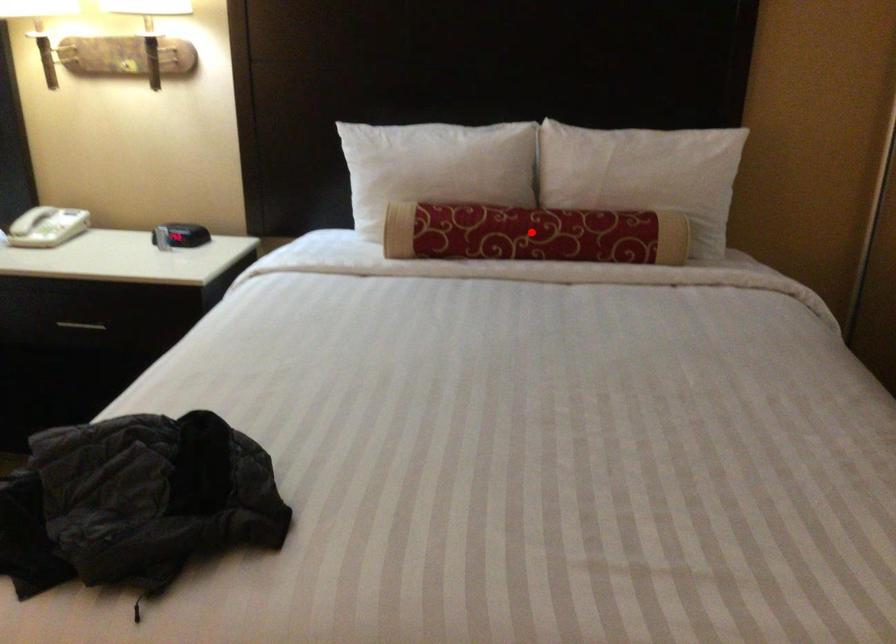
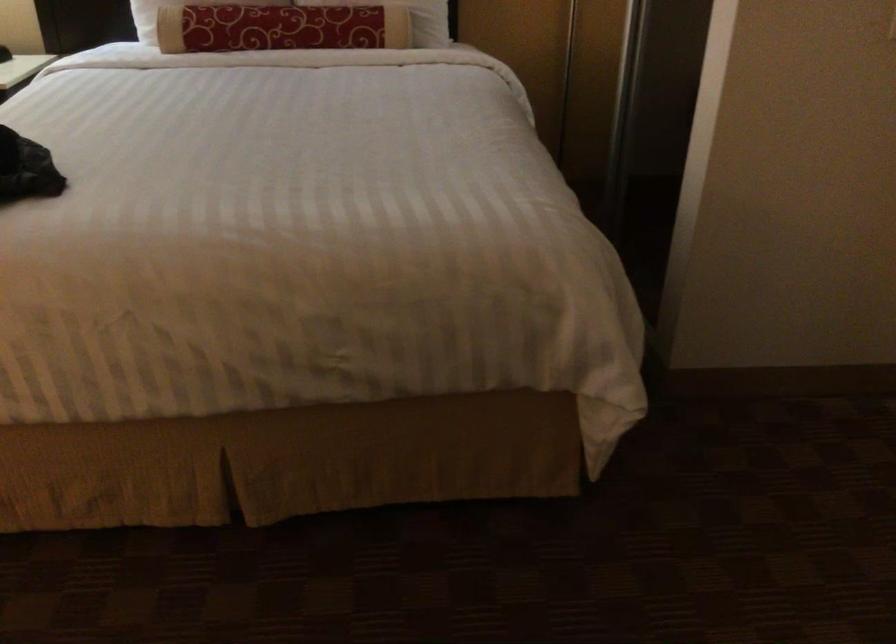
Where in the second image is the point corresponding to the highlighted location from the first image?

(280, 28)